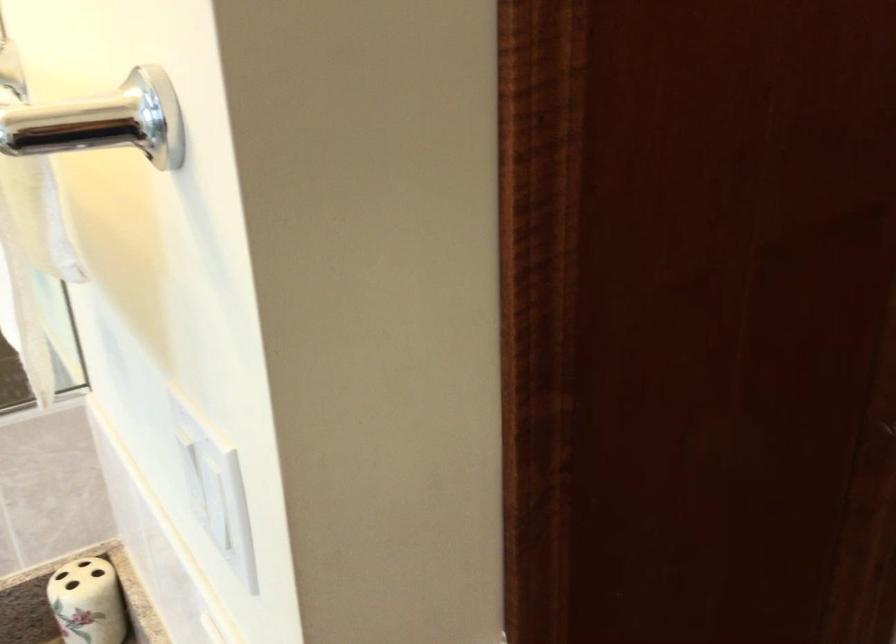
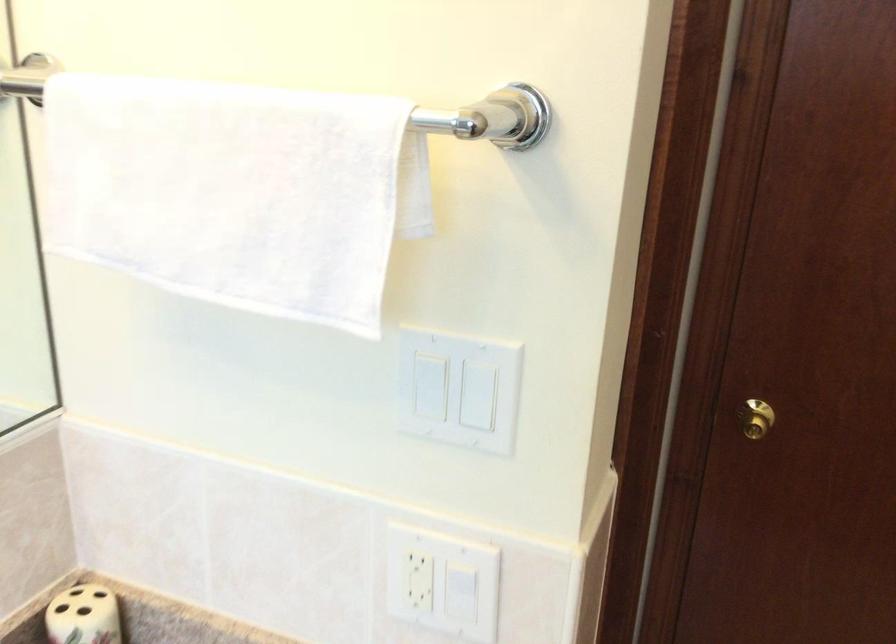
Find the pixel in the second image that matches pixel 231 480 in the first image.

(458, 389)